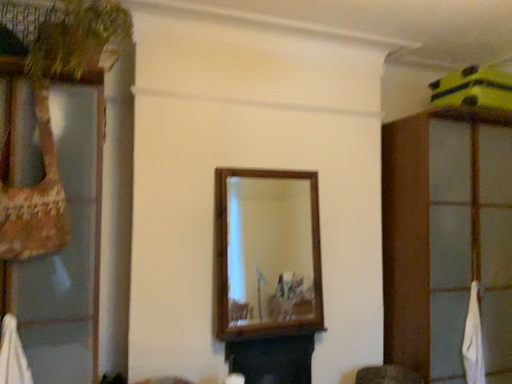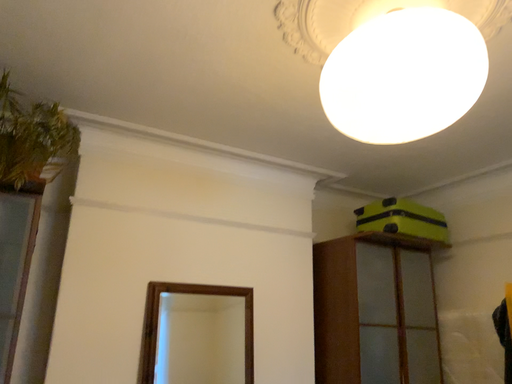
Question: How did the camera likely rotate when shooting the video?

Choices:
 (A) rotated downward
 (B) rotated upward

Answer: (B)